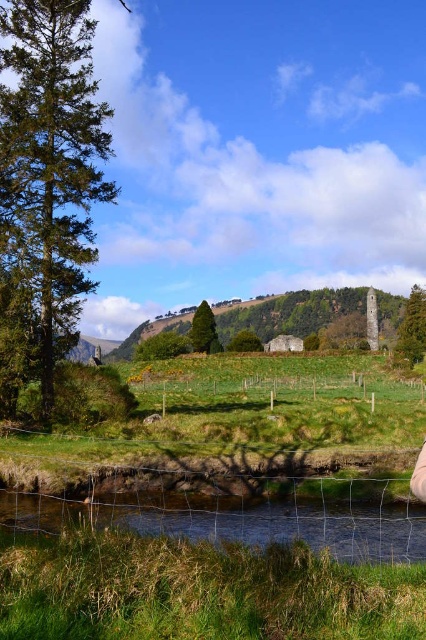
Between point (58, 513) and point (238, 387), which one is positioned behind?

The point (238, 387) is more distant.

Between clear water at lower center and green grassy fence at center, which one is positioned higher?

clear water at lower center is higher up.

Is point (207, 522) farther from camera compared to point (264, 392)?

No, (207, 522) is closer to viewer.

You are a GUI agent. You are given a task and a screenshot of the screen. Output one action in this format:
    pyautogui.click(x=<x>, y=<y>)
    Task: Click on the clear water at lower center
    Image resolution: width=426 pixels, height=640 pixels.
    Given the screenshot: What is the action you would take?
    pyautogui.click(x=241, y=520)